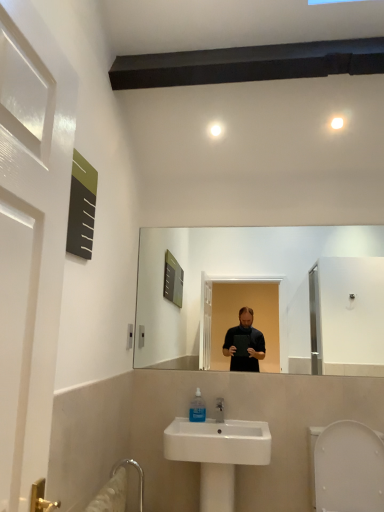
The image size is (384, 512). Describe the element at coordinates (197, 408) in the screenshot. I see `translucent plastic mouthwash at sink` at that location.

Where is `translucent plastic mouthwash at sink`? translucent plastic mouthwash at sink is located at coordinates (197, 408).

Where is `mouthwash above the white ceramic sink at lower center (from the image's perspective)`? Image resolution: width=384 pixels, height=512 pixels. mouthwash above the white ceramic sink at lower center (from the image's perspective) is located at coordinates (197, 408).

Considering the sizes of white ceramic sink at lower center and translucent plastic mouthwash at sink in the image, is white ceramic sink at lower center bigger or smaller than translucent plastic mouthwash at sink?

Clearly, white ceramic sink at lower center is larger in size than translucent plastic mouthwash at sink.

Can translucent plastic mouthwash at sink be found inside white ceramic sink at lower center?

Yes, white ceramic sink at lower center contains translucent plastic mouthwash at sink.

From a real-world perspective, is white plastic bidet at lower right located higher than translucent plastic mouthwash at sink?

Actually, white plastic bidet at lower right is physically below translucent plastic mouthwash at sink in the real world.

How different are the orientations of white plastic bidet at lower right and translucent plastic mouthwash at sink in degrees?

The angle between the facing direction of white plastic bidet at lower right and the facing direction of translucent plastic mouthwash at sink is 1.24 degrees.

From the image's perspective, who appears lower, white plastic bidet at lower right or translucent plastic mouthwash at sink?

white plastic bidet at lower right, from the image's perspective.

Based on the photo, is white plastic bidet at lower right to the right of translucent plastic mouthwash at sink from the viewer's perspective?

Indeed, white plastic bidet at lower right is positioned on the right side of translucent plastic mouthwash at sink.

Does white ceramic sink at lower center have a greater width compared to white plastic bidet at lower right?

In fact, white ceramic sink at lower center might be narrower than white plastic bidet at lower right.

Is white plastic bidet at lower right completely or partially inside white ceramic sink at lower center?

No, white ceramic sink at lower center does not contain white plastic bidet at lower right.

Is white ceramic sink at lower center bigger than white plastic bidet at lower right?

Indeed, white ceramic sink at lower center has a larger size compared to white plastic bidet at lower right.

Considering the positions of objects white ceramic sink at lower center and white plastic bidet at lower right in the image provided, who is more to the right, white ceramic sink at lower center or white plastic bidet at lower right?

white plastic bidet at lower right.

Is translucent plastic mouthwash at sink turned away from white plastic bidet at lower right?

No.

Would you say translucent plastic mouthwash at sink is a long distance from white plastic bidet at lower right?

translucent plastic mouthwash at sink is actually quite close to white plastic bidet at lower right.

Between translucent plastic mouthwash at sink and white plastic bidet at lower right, which one has larger width?

white plastic bidet at lower right.

From their relative heights in the image, would you say translucent plastic mouthwash at sink is taller or shorter than white plastic bidet at lower right?

Clearly, translucent plastic mouthwash at sink is shorter compared to white plastic bidet at lower right.

Who is smaller, translucent plastic mouthwash at sink or white ceramic sink at lower center?

Smaller between the two is translucent plastic mouthwash at sink.

Is translucent plastic mouthwash at sink not near white ceramic sink at lower center?

That's not correct — translucent plastic mouthwash at sink is a little close to white ceramic sink at lower center.

Consider the image. Considering the sizes of objects translucent plastic mouthwash at sink and white ceramic sink at lower center in the image provided, who is wider, translucent plastic mouthwash at sink or white ceramic sink at lower center?

white ceramic sink at lower center is wider.

From a real-world perspective, is translucent plastic mouthwash at sink physically above white ceramic sink at lower center?

Yes, from a real-world perspective, translucent plastic mouthwash at sink is above white ceramic sink at lower center.

I want to click on sink behind the white plastic bidet at lower right, so click(x=218, y=454).

Looking at this image, from the image's perspective, which is above, white plastic bidet at lower right or white ceramic sink at lower center?

white plastic bidet at lower right.

Is white plastic bidet at lower right looking in the opposite direction of white ceramic sink at lower center?

No, white plastic bidet at lower right is not facing away from white ceramic sink at lower center.

Locate an element on the screen. This screenshot has width=384, height=512. mouthwash located on the left of white ceramic sink at lower center is located at coordinates (197, 408).

What are the coordinates of `bidet located on the right of translucent plastic mouthwash at sink` in the screenshot? It's located at (349, 468).

Based on their spatial positions, is white ceramic sink at lower center or white plastic bidet at lower right closer to translucent plastic mouthwash at sink?

white ceramic sink at lower center is closer to translucent plastic mouthwash at sink.

Which object lies nearer to the anchor point white ceramic sink at lower center, white plastic bidet at lower right or translucent plastic mouthwash at sink?

translucent plastic mouthwash at sink is positioned closer to the anchor white ceramic sink at lower center.

Which object lies nearer to the anchor point white plastic bidet at lower right, white ceramic sink at lower center or translucent plastic mouthwash at sink?

white ceramic sink at lower center is closer to white plastic bidet at lower right.

Which object lies nearer to the anchor point white plastic bidet at lower right, translucent plastic mouthwash at sink or white ceramic sink at lower center?

white ceramic sink at lower center is closer to white plastic bidet at lower right.

Which object lies further to the anchor point white ceramic sink at lower center, translucent plastic mouthwash at sink or white plastic bidet at lower right?

white plastic bidet at lower right is positioned further to the anchor white ceramic sink at lower center.

Considering their positions, is white plastic bidet at lower right positioned closer to translucent plastic mouthwash at sink than white ceramic sink at lower center?

Among the two, white ceramic sink at lower center is located nearer to translucent plastic mouthwash at sink.

Where is `sink between translucent plastic mouthwash at sink and white plastic bidet at lower right from left to right`? The image size is (384, 512). sink between translucent plastic mouthwash at sink and white plastic bidet at lower right from left to right is located at coordinates (218, 454).